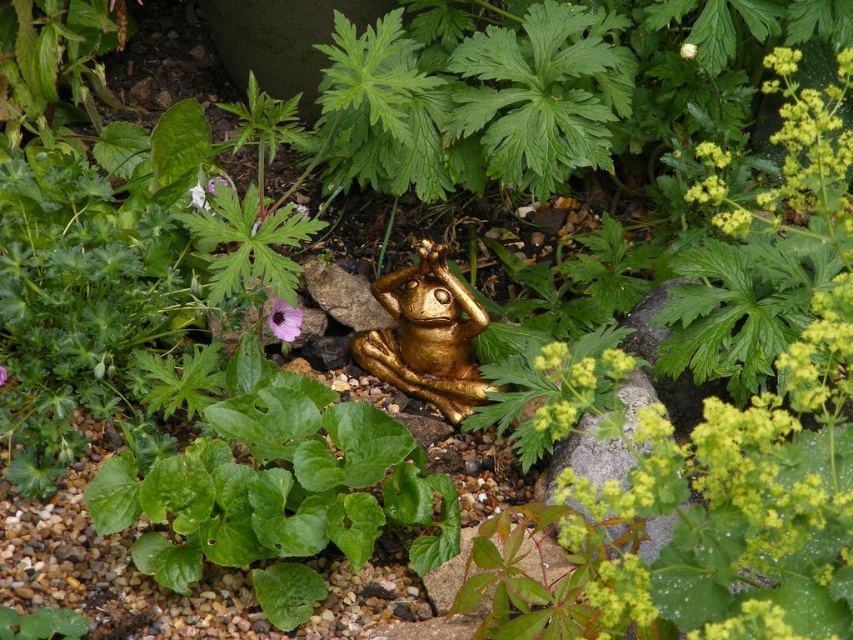
Question: Which object is farther from the camera taking this photo?

Choices:
 (A) gold metallic frog at center
 (B) purple matte flower at center

Answer: (A)

Question: Is gold metallic frog at center thinner than purple matte flower at center?

Choices:
 (A) no
 (B) yes

Answer: (A)

Question: Does gold metallic frog at center have a larger size compared to purple matte flower at center?

Choices:
 (A) no
 (B) yes

Answer: (B)

Question: Which point is farther from the camera taking this photo?

Choices:
 (A) (404, 268)
 (B) (289, 323)

Answer: (A)

Question: Can you confirm if gold metallic frog at center is positioned to the left of purple matte flower at center?

Choices:
 (A) yes
 (B) no

Answer: (B)

Question: Which object is farther from the camera taking this photo?

Choices:
 (A) gold metallic frog at center
 (B) purple matte flower at center

Answer: (A)